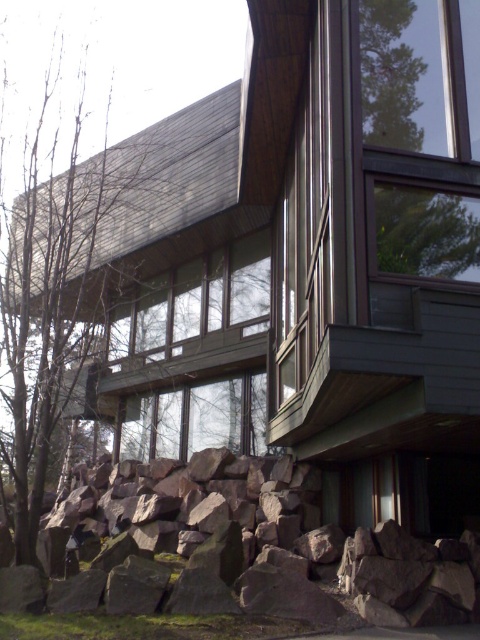
Question: Which point is closer to the camera?

Choices:
 (A) bare branches at left
 (B) brown rough rock at lower left

Answer: (A)

Question: Can you confirm if brown rough rock at lower left is positioned to the right of bare branches at left?

Choices:
 (A) yes
 (B) no

Answer: (A)

Question: Which object appears closest to the camera in this image?

Choices:
 (A) bare branches at left
 (B) brown rough rock at lower left

Answer: (A)

Question: Does brown rough rock at lower left appear on the left side of bare branches at left?

Choices:
 (A) yes
 (B) no

Answer: (B)

Question: Is brown rough rock at lower left to the right of bare branches at left from the viewer's perspective?

Choices:
 (A) no
 (B) yes

Answer: (B)